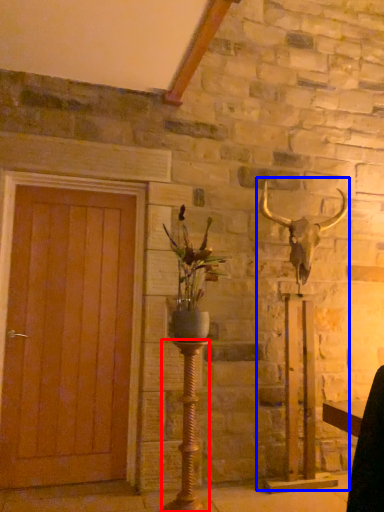
Question: Which of the following is the farthest to the observer, candle holder (highlighted by a red box) or sculpture (highlighted by a blue box)?

Choices:
 (A) candle holder
 (B) sculpture

Answer: (B)